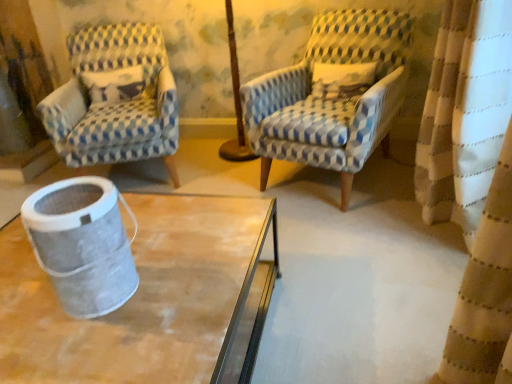
Image resolution: width=512 pixels, height=384 pixels. Identify the location of free point below blue and white checkered fabric armchair at center, arranged as the second chair when viewed from the left (from a real-world perspective). (323, 185).